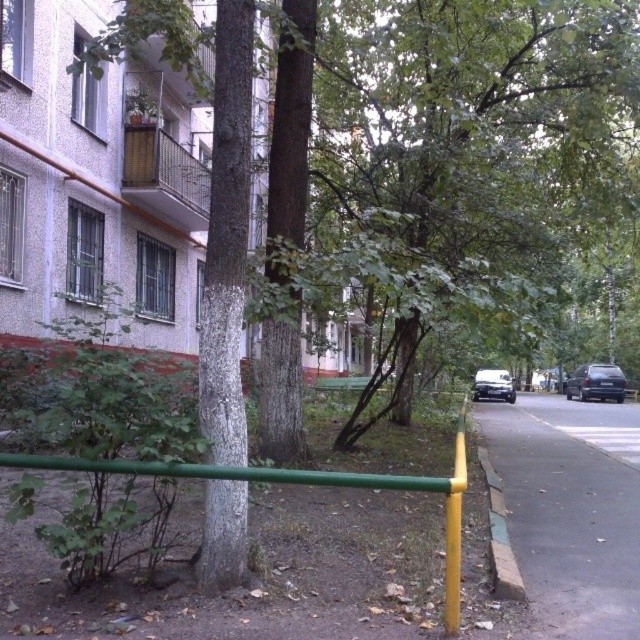
Who is lower down, green painted metal fence at lower center or shiny silver van at right?

shiny silver van at right

Identify the location of green painted metal fence at lower center. (307, 484).

Is point (406, 486) more distant than point (481, 388)?

No, (406, 486) is in front of (481, 388).

You are a GUI agent. You are given a task and a screenshot of the screen. Output one action in this format:
    pyautogui.click(x=<x>, y=<y>)
    Task: Click on the green painted metal fence at lower center
    This screenshot has height=640, width=640.
    Given the screenshot: What is the action you would take?
    pyautogui.click(x=307, y=484)

Can you confirm if green bark tree at center is positioned below shiny silver van at right?

Actually, green bark tree at center is above shiny silver van at right.

In the scene shown: Is green bark tree at center bigger than shiny silver van at right?

Actually, green bark tree at center might be smaller than shiny silver van at right.

Who is more forward, (163,19) or (499,396)?

Positioned in front is point (163,19).

Identify the location of green bark tree at center. (227, 237).

Between asphalt pavement at lower right and yellow painted concrete curb at lower right, which one is positioned higher?

yellow painted concrete curb at lower right

Is asphalt pavement at lower right bigger than yellow painted concrete curb at lower right?

Yes.

Who is more forward, (x=605, y=547) or (x=477, y=428)?

Positioned in front is point (x=605, y=547).

You are a GUI agent. You are given a task and a screenshot of the screen. Output one action in this format:
    pyautogui.click(x=<x>, y=<y>)
    Task: Click on the asphalt pavement at lower right
    The width and height of the screenshot is (640, 640).
    Given the screenshot: What is the action you would take?
    pyautogui.click(x=570, y=509)